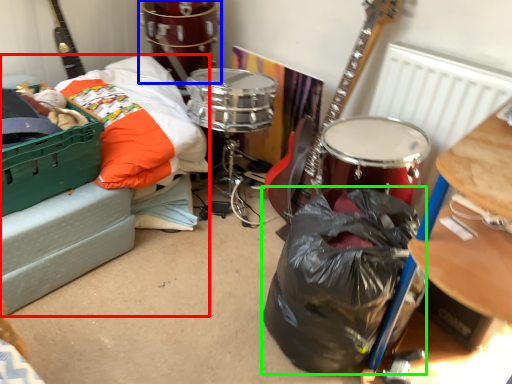
Question: Which object is positioned farthest from couch (highlighted by a red box)? Select from drum (highlighted by a blue box) and garbage (highlighted by a green box).

Choices:
 (A) drum
 (B) garbage

Answer: (B)